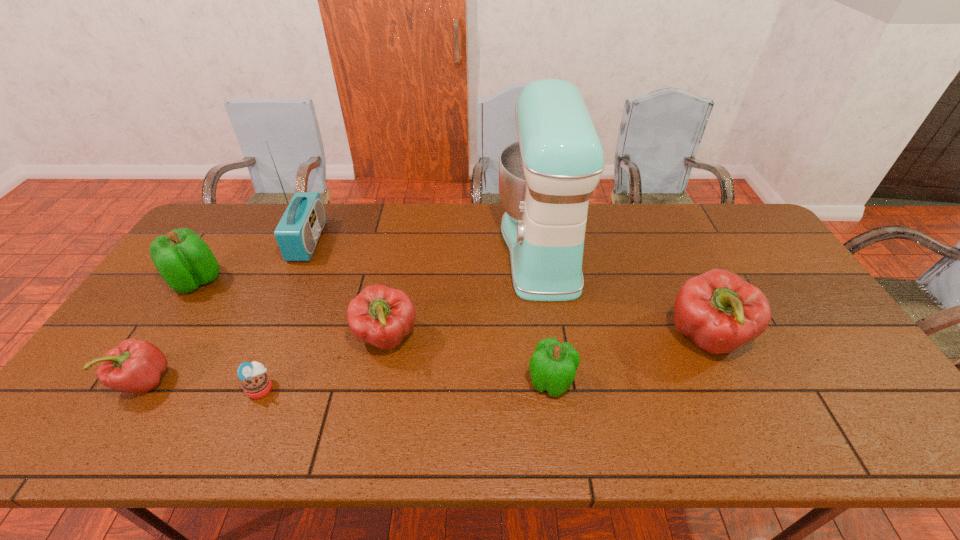
You are a GUI agent. You are given a task and a screenshot of the screen. Output one action in this format:
    pyautogui.click(x=<x>, y=<y>)
    Task: Click on the light mixer
    Image resolution: width=960 pixels, height=540 pixels.
    Given the screenshot: What is the action you would take?
    pyautogui.click(x=546, y=178)

Identify the location of mixer. This screenshot has width=960, height=540. (546, 178).

Where is `light radio receiver`? light radio receiver is located at coordinates (297, 234).

The image size is (960, 540). Find the location of `the second tallest object`. the second tallest object is located at coordinates (297, 234).

Locate an element on the screen. The image size is (960, 540). the rightmost bell pepper is located at coordinates (718, 311).

I want to click on the biggest pink bell pepper, so click(718, 311).

The width and height of the screenshot is (960, 540). Find the location of `the farthest bell pepper`. the farthest bell pepper is located at coordinates (183, 259).

Locate an element on the screen. the bigger green bell pepper is located at coordinates (183, 259).

This screenshot has width=960, height=540. What are the coordinates of `the fifth object from left to right` in the screenshot? It's located at (381, 316).

Where is `the second pink bell pepper from left to right`? This screenshot has width=960, height=540. the second pink bell pepper from left to right is located at coordinates (381, 316).